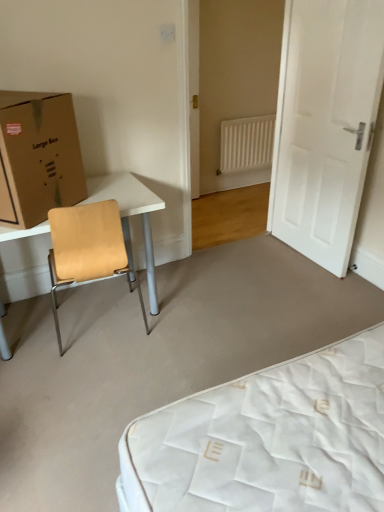
Image resolution: width=384 pixels, height=512 pixels. What are the coordinates of `brown cardboard box at left` in the screenshot? It's located at (38, 156).

Considering the points (117, 175) and (14, 160), which point is behind, point (117, 175) or point (14, 160)?

The point (117, 175) is farther from the camera.

How much distance is there between light brown wood table at left and brown cardboard box at left?

They are 27.75 centimeters apart.

From the picture: From a real-world perspective, which object stands above the other?

brown cardboard box at left.

In the scene shown: Is light brown wood table at left oriented away from brown cardboard box at left?

That's not correct — light brown wood table at left is not looking away from brown cardboard box at left.

How far apart are light brown wood table at left and white matte door at right?

The distance of light brown wood table at left from white matte door at right is 4.19 feet.

From a real-world perspective, is light brown wood table at left on white matte door at right?

Actually, light brown wood table at left is physically below white matte door at right in the real world.

From the image's perspective, would you say light brown wood table at left is positioned over white matte door at right?

No, from the image's perspective, light brown wood table at left is not above white matte door at right.

Is light brown wood table at left surrounding white matte door at right?

Definitely not — white matte door at right is not inside light brown wood table at left.

Is white matte door at right bigger than light brown wood table at left?

Incorrect, white matte door at right is not larger than light brown wood table at left.

Would you say white matte door at right is outside light brown wood table at left?

white matte door at right lies outside light brown wood table at left's area.

Could you tell me if white matte door at right is turned towards light brown wood table at left?

Yes.

How different are the orientations of white matte door at right and white plastic radiator at center in degrees?

The facing directions of white matte door at right and white plastic radiator at center are 88.8 degrees apart.

From the picture: From the image's perspective, is white matte door at right above white plastic radiator at center?

No, from the image's perspective, white matte door at right is not above white plastic radiator at center.

Can you confirm if white matte door at right is positioned to the left of white plastic radiator at center?

Incorrect, white matte door at right is not on the left side of white plastic radiator at center.

In terms of width, does white matte door at right look wider or thinner when compared to white plastic radiator at center?

In the image, white matte door at right appears to be wider than white plastic radiator at center.

Find the location of a particular element. Image resolution: width=384 pixels, height=512 pixels. table on the left side of white plastic radiator at center is located at coordinates (130, 214).

Looking at this image, is white plastic radiator at center positioned with its back to light brown wood table at left?

No, white plastic radiator at center's orientation is not away from light brown wood table at left.

Consider the image. Which object is positioned more to the left, white plastic radiator at center or light brown wood table at left?

light brown wood table at left is more to the left.

Is point (153, 193) farther from viewer compared to point (258, 158)?

No.

Is white plastic radiator at center a part of light brown wood table at left?

Actually, white plastic radiator at center is outside light brown wood table at left.

From the image's perspective, is light brown wood table at left over white plastic radiator at center?

No, from the image's perspective, light brown wood table at left is not above white plastic radiator at center.

In the scene shown: Is light brown wood table at left taller than white plastic radiator at center?

Yes, light brown wood table at left is taller than white plastic radiator at center.

Can you confirm if brown cardboard box at left is positioned to the right of white plastic radiator at center?

No, brown cardboard box at left is not to the right of white plastic radiator at center.

Considering the sizes of objects brown cardboard box at left and white plastic radiator at center in the image provided, who is wider, brown cardboard box at left or white plastic radiator at center?

Wider between the two is brown cardboard box at left.

At what (x,y) coordinates should I click in order to perform the action: click on table behind the brown cardboard box at left. Please return your answer as a coordinate pair (x, y). The height and width of the screenshot is (512, 384). Looking at the image, I should click on (130, 214).

I want to click on door that is above the light brown wood table at left (from a real-world perspective), so click(x=325, y=124).

When comparing their distances from white matte door at right, does light brown wood table at left or white plastic radiator at center seem further?

white plastic radiator at center.

Looking at the image, which one is located closer to light brown wood table at left, white matte door at right or brown cardboard box at left?

brown cardboard box at left is closer to light brown wood table at left.

When comparing their distances from light brown wood table at left, does brown cardboard box at left or white plastic radiator at center seem closer?

brown cardboard box at left lies closer to light brown wood table at left than the other object.

Estimate the real-world distances between objects in this image. Which object is further from white plastic radiator at center, light brown wood table at left or brown cardboard box at left?

brown cardboard box at left is further to white plastic radiator at center.

When comparing their distances from white plastic radiator at center, does brown cardboard box at left or light brown wood table at left seem further?

The object further to white plastic radiator at center is brown cardboard box at left.

Based on their spatial positions, is light brown wood table at left or brown cardboard box at left further from white matte door at right?

brown cardboard box at left is further to white matte door at right.

When comparing their distances from brown cardboard box at left, does white matte door at right or white plastic radiator at center seem closer?

Among the two, white matte door at right is located nearer to brown cardboard box at left.

Which object lies further to the anchor point white plastic radiator at center, white matte door at right or light brown wood table at left?

light brown wood table at left is positioned further to the anchor white plastic radiator at center.

You are a GUI agent. You are given a task and a screenshot of the screen. Output one action in this format:
    pyautogui.click(x=<x>, y=<y>)
    Task: Click on the door between brown cardboard box at left and white plastic radiator at center from front to back
    
    Given the screenshot: What is the action you would take?
    pyautogui.click(x=325, y=124)

Where is `door between light brown wood table at left and white plastic radiator at center along the z-axis`? The width and height of the screenshot is (384, 512). door between light brown wood table at left and white plastic radiator at center along the z-axis is located at coordinates (325, 124).

Where is `table located between brown cardboard box at left and white plastic radiator at center in the depth direction`? table located between brown cardboard box at left and white plastic radiator at center in the depth direction is located at coordinates (x=130, y=214).

Identify the location of table between brown cardboard box at left and white matte door at right in the horizontal direction. The height and width of the screenshot is (512, 384). (130, 214).